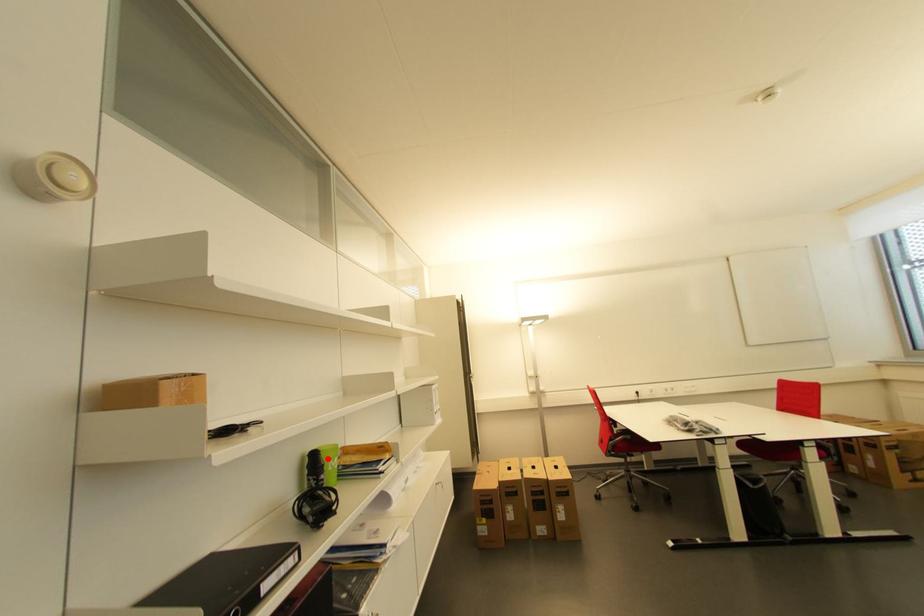
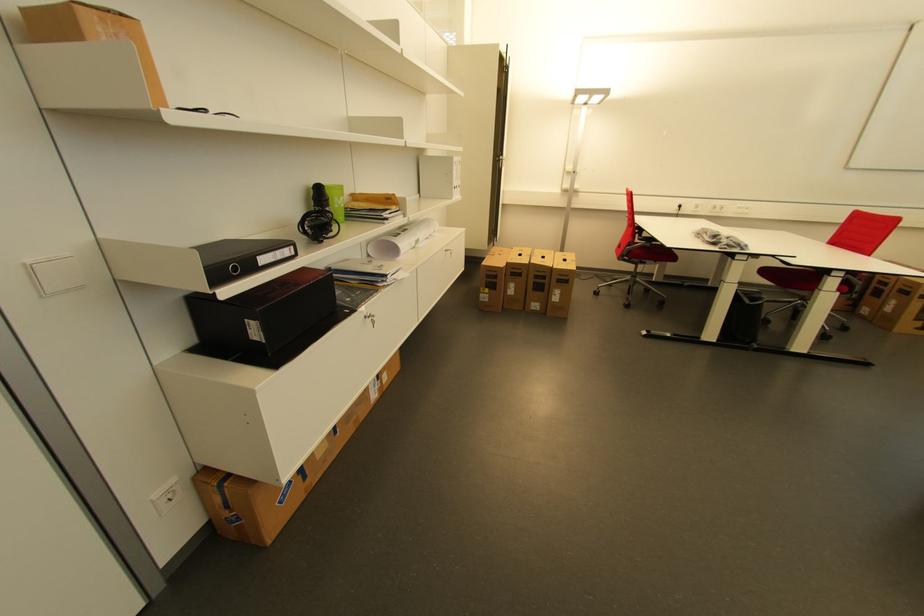
Question: I am providing you with two images of the same scene from different viewpoints. A red point is marked on the first image. At the location where the point appears in image 1, is it still visible in image 2?

Choices:
 (A) Yes
 (B) No

Answer: (A)